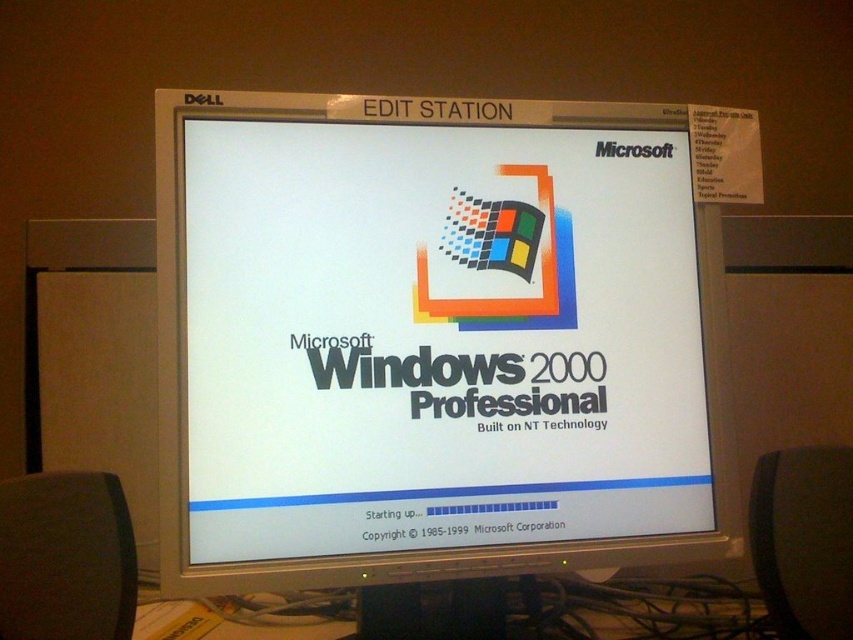
You are looking at the Dell computer monitor showing the Microsoft Windows 2000 Professional startup screen. There are two points marked on the screen at coordinates point (686, 522) and point (567, 321). If you were to reach out and touch both points, which point would your finger reach first?

Point (686, 522) is closer to the camera than point (567, 321), so your finger would reach point (686, 522) first.